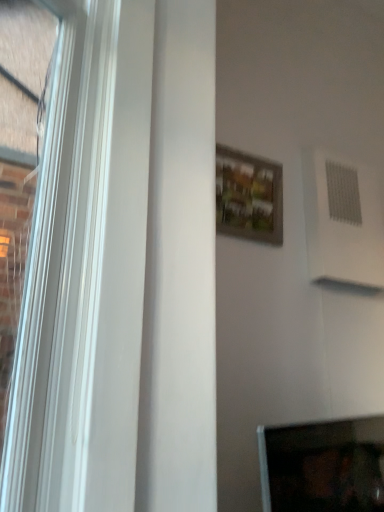
This screenshot has width=384, height=512. What do you see at coordinates (248, 196) in the screenshot? I see `wooden framed picture at center` at bounding box center [248, 196].

Measure the distance between wooden framed picture at center and camera.

5.28 feet.

The width and height of the screenshot is (384, 512). Find the location of `wooden framed picture at center`. wooden framed picture at center is located at coordinates (248, 196).

Measure the distance between point (231, 194) and camera.

1.66 meters.

This screenshot has width=384, height=512. What do you see at coordinates (323, 466) in the screenshot?
I see `matte black monitor at lower right` at bounding box center [323, 466].

Locate an element on the screen. This screenshot has height=512, width=384. matte black monitor at lower right is located at coordinates (323, 466).

At what (x,y) coordinates should I click in order to perform the action: click on wooden framed picture at center. Please return your answer as a coordinate pair (x, y). The width and height of the screenshot is (384, 512). Looking at the image, I should click on (248, 196).

Is matte black monitor at lower right to the left of wooden framed picture at center from the viewer's perspective?

No.

In the image, is matte black monitor at lower right positioned in front of or behind wooden framed picture at center?

matte black monitor at lower right is positioned closer to the viewer than wooden framed picture at center.

Which is further, (373, 440) or (266, 228)?

Positioned behind is point (266, 228).

From the image's perspective, is matte black monitor at lower right on wooden framed picture at center?

Actually, matte black monitor at lower right appears below wooden framed picture at center in the image.

From a real-world perspective, between matte black monitor at lower right and wooden framed picture at center, who is vertically higher?

wooden framed picture at center.

Can you confirm if matte black monitor at lower right is wider than wooden framed picture at center?

Yes.

In terms of height, does matte black monitor at lower right look taller or shorter compared to wooden framed picture at center?

In the image, matte black monitor at lower right appears to be shorter than wooden framed picture at center.

Considering the sizes of matte black monitor at lower right and wooden framed picture at center in the image, is matte black monitor at lower right bigger or smaller than wooden framed picture at center?

matte black monitor at lower right is bigger than wooden framed picture at center.

Is matte black monitor at lower right inside the boundaries of wooden framed picture at center, or outside?

matte black monitor at lower right is spatially situated outside wooden framed picture at center.

Is the surface of matte black monitor at lower right in direct contact with wooden framed picture at center?

No, matte black monitor at lower right is not with wooden framed picture at center.

Does matte black monitor at lower right turn towards wooden framed picture at center?

No, matte black monitor at lower right is not turned towards wooden framed picture at center.

Can you tell me how much matte black monitor at lower right and wooden framed picture at center differ in facing direction?

24.6 degrees separate the facing orientations of matte black monitor at lower right and wooden framed picture at center.

Where is `computer screen in front of the wooden framed picture at center`? computer screen in front of the wooden framed picture at center is located at coordinates (323, 466).

Is wooden framed picture at center at the left side of matte black monitor at lower right?

Yes.

Is wooden framed picture at center positioned behind matte black monitor at lower right?

Yes, it is behind matte black monitor at lower right.

Is point (246, 159) closer or farther from the camera than point (310, 488)?

Point (246, 159) is closer to the camera than point (310, 488).

From the image's perspective, which is above, wooden framed picture at center or matte black monitor at lower right?

wooden framed picture at center is shown above in the image.

From the picture: From a real-world perspective, is wooden framed picture at center located higher than matte black monitor at lower right?

Yes.

Considering the sizes of wooden framed picture at center and matte black monitor at lower right in the image, is wooden framed picture at center wider or thinner than matte black monitor at lower right?

Clearly, wooden framed picture at center has less width compared to matte black monitor at lower right.

Does wooden framed picture at center have a greater height compared to matte black monitor at lower right?

Yes, wooden framed picture at center is taller than matte black monitor at lower right.

Is wooden framed picture at center bigger than matte black monitor at lower right?

No.

Is wooden framed picture at center situated inside matte black monitor at lower right or outside?

wooden framed picture at center exists outside the volume of matte black monitor at lower right.

Is wooden framed picture at center far away from matte black monitor at lower right?

Yes.

Could you tell me if wooden framed picture at center is facing matte black monitor at lower right?

No, wooden framed picture at center does not turn towards matte black monitor at lower right.

I want to click on computer screen that is under the wooden framed picture at center (from a real-world perspective), so click(x=323, y=466).

The width and height of the screenshot is (384, 512). Find the location of `computer screen on the right of wooden framed picture at center`. computer screen on the right of wooden framed picture at center is located at coordinates (323, 466).

Image resolution: width=384 pixels, height=512 pixels. Find the location of `computer screen in front of the wooden framed picture at center`. computer screen in front of the wooden framed picture at center is located at coordinates (323, 466).